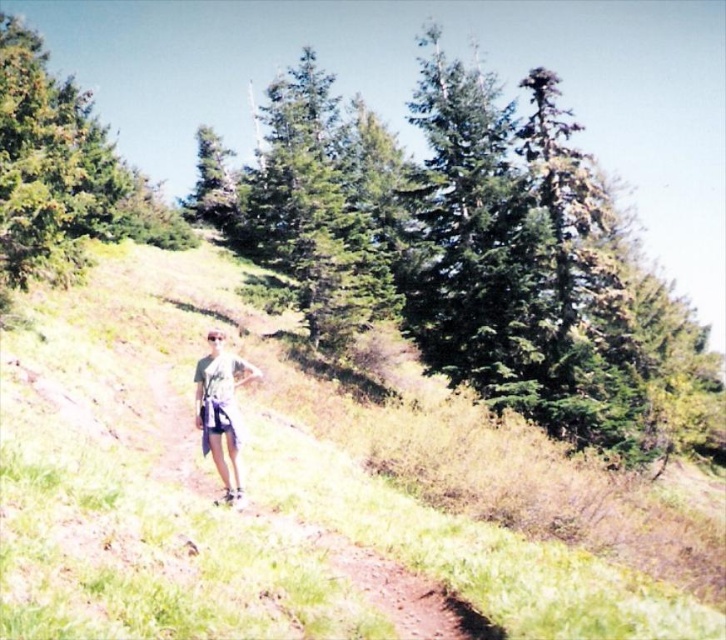
Question: Is light gray fabric shorts at center above white cotton shorts at center?

Choices:
 (A) yes
 (B) no

Answer: (A)

Question: Which is nearer to the gravel path at center?

Choices:
 (A) light gray fabric shorts at center
 (B) green grassy hillside at center
 (C) green textured pine tree at center
 (D) white cotton shorts at center

Answer: (D)

Question: Based on their relative distances, which object is farther from the green grassy hillside at center?

Choices:
 (A) white cotton shorts at center
 (B) green textured pine tree at center
 (C) light gray fabric shorts at center
 (D) gravel path at center

Answer: (B)

Question: Can you confirm if green grassy hillside at center is thinner than green textured pine tree at center?

Choices:
 (A) no
 (B) yes

Answer: (B)

Question: From the image, what is the correct spatial relationship of green grassy hillside at center in relation to green textured pine tree at center?

Choices:
 (A) below
 (B) above

Answer: (A)

Question: Which point appears farthest from the camera in this image?

Choices:
 (A) (473, 435)
 (B) (221, 372)
 (C) (216, 429)
 (D) (454, 374)

Answer: (D)